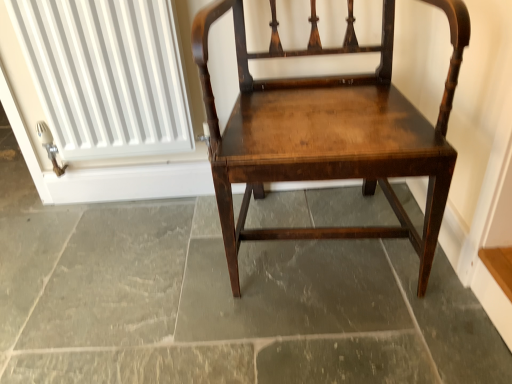
Identify the location of vacant area situated below shiny dark wood chair at center (from a real-world perspective). [x=316, y=242].